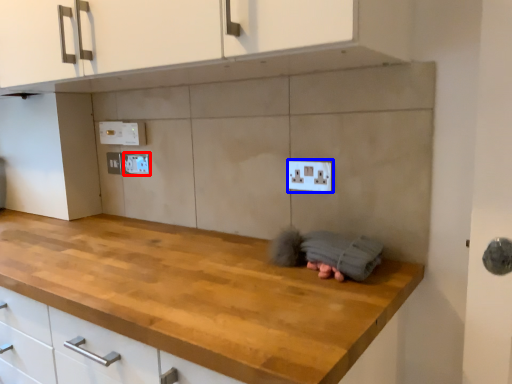
Question: Which object is further to the camera taking this photo, electric outlet (highlighted by a red box) or electric outlet (highlighted by a blue box)?

Choices:
 (A) electric outlet
 (B) electric outlet

Answer: (A)